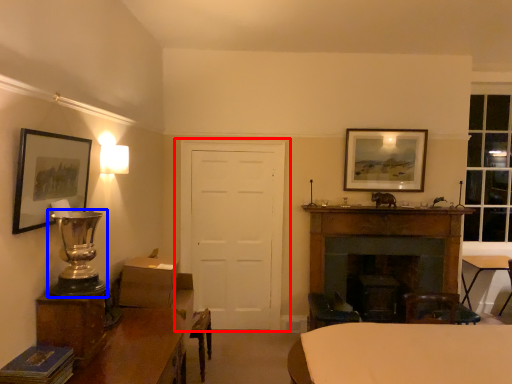
Question: Which object appears farthest to the camera in this image, door (highlighted by a red box) or table lamp (highlighted by a blue box)?

Choices:
 (A) door
 (B) table lamp

Answer: (A)